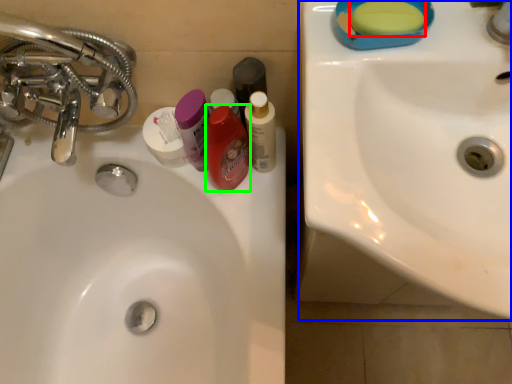
Question: Which object is the farthest from soap (highlighted by a red box)? Choose among these: sink (highlighted by a blue box) or mouthwash (highlighted by a green box).

Choices:
 (A) sink
 (B) mouthwash

Answer: (B)